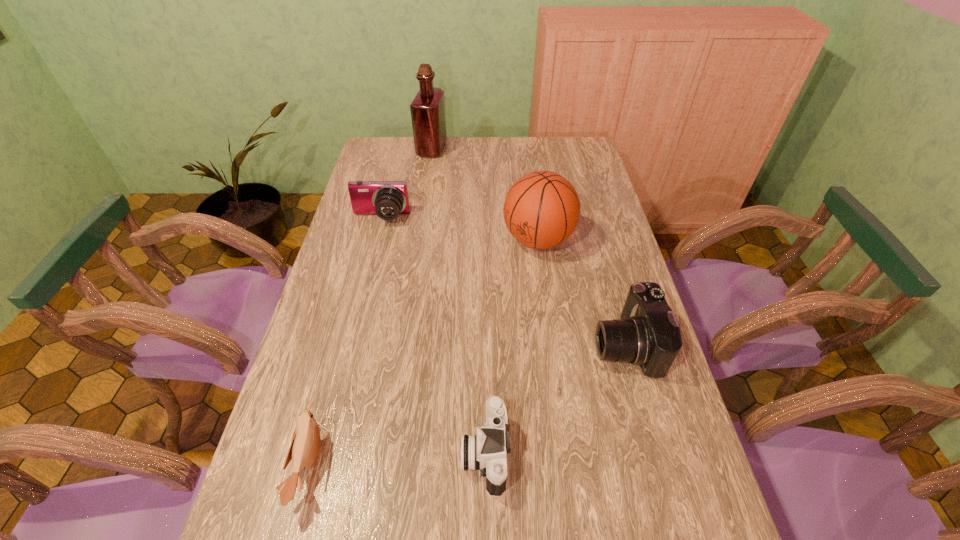
At what (x,y) coordinates should I click in order to perform the action: click on free area in between the bird and the leftmost camera. Please return your answer as a coordinate pair (x, y). The width and height of the screenshot is (960, 540). Looking at the image, I should click on (346, 342).

Find the location of a particular element. This screenshot has height=540, width=960. vacant area that lies between the tallest object and the basketball is located at coordinates (485, 194).

The image size is (960, 540). Identify the location of unoccupied area between the nearest camera and the liquor. (459, 301).

What are the coordinates of `free spot between the fourth farthest object and the second tallest object` in the screenshot? It's located at (582, 292).

Where is `object that is the closest to the fourth farthest object`? This screenshot has width=960, height=540. object that is the closest to the fourth farthest object is located at coordinates (541, 210).

Find the location of a particular element. object that is the fourth closest to the fifth shortest object is located at coordinates (486, 451).

You are a GUI agent. You are given a task and a screenshot of the screen. Output one action in this format:
    pyautogui.click(x=<x>, y=<y>)
    Task: Click on the camera that is the closest to the bird
    This screenshot has width=960, height=540.
    Given the screenshot: What is the action you would take?
    pyautogui.click(x=486, y=451)

This screenshot has width=960, height=540. What are the coordinates of `camera that can be found as the second closest to the second nearest camera` in the screenshot? It's located at (387, 199).

Where is `free space that satisfies the following two spatial constraints: 1. on the front-facing side of the second camera from left to right; 2. on the left side of the farthest camera`? The image size is (960, 540). free space that satisfies the following two spatial constraints: 1. on the front-facing side of the second camera from left to right; 2. on the left side of the farthest camera is located at coordinates (323, 453).

Image resolution: width=960 pixels, height=540 pixels. Identify the location of vacant space that satisfies the following two spatial constraints: 1. on the front-facing side of the leftmost camera; 2. on the right side of the third object from right to left. (323, 453).